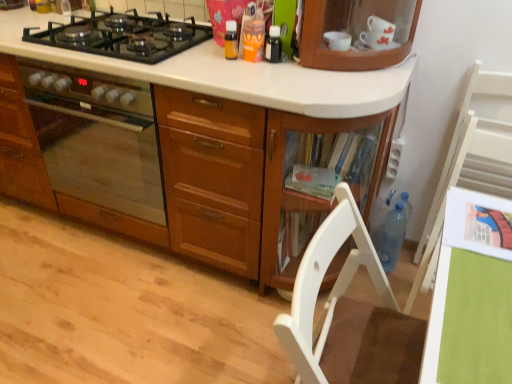
Question: From the image's perspective, is blue translucent bottle at lower right located above or below black glass bottle at upper center, which ranks as the 3th kitchen appliance in left-to-right order?

Choices:
 (A) below
 (B) above

Answer: (A)

Question: From a real-world perspective, is blue translucent bottle at lower right above or below black glass bottle at upper center, the first kitchen appliance in the right-to-left sequence?

Choices:
 (A) below
 (B) above

Answer: (A)

Question: Which object is positioned closest to the black glass bottle at upper center, the first kitchen appliance in the right-to-left sequence?

Choices:
 (A) translucent plastic bottle at upper center, marked as the 1th kitchen appliance in a left-to-right arrangement
 (B) white wood chair at right, positioned as the 1th chair in right-to-left order
 (C) matte wooden oven at left
 (D) black glass gas stove at upper left
 (E) orange plastic cup at upper center, marked as the 2th kitchen appliance in a right-to-left arrangement

Answer: (E)

Question: Considering the real-world distances, which object is farthest from the white wood chair at right, marked as the second chair in a left-to-right arrangement?

Choices:
 (A) green matte table at lower right
 (B) orange plastic cup at upper center, marked as the 2th kitchen appliance in a right-to-left arrangement
 (C) black glass bottle at upper center, which ranks as the 3th kitchen appliance in left-to-right order
 (D) black glass gas stove at upper left
 (E) matte wooden oven at left

Answer: (E)